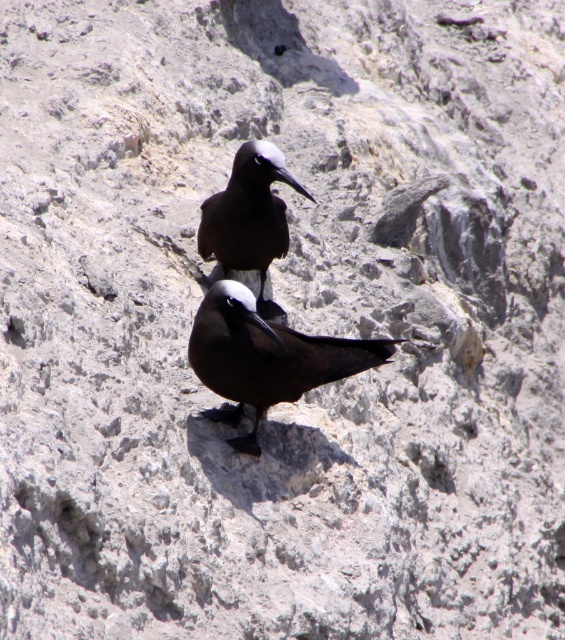
You are a birdwatcher trying to identify birds in the image. There is a point marked at coordinates point (266,356). What bird is located at that point?

The point (266,356) indicates a matte black bird at center.

You are a photographer aiming to capture a clear photo of both the matte black bird at center and the brown glossy bird at center. Since you can only focus on one bird at a time, which bird should you focus on to ensure the other remains in the background?

You should focus on the matte black bird at center because it is closer to the viewer, allowing the brown glossy bird at center to naturally fall into the background.

You are a birdwatcher observing two birds on a rocky surface. You notice a matte black bird at center and a brown glossy bird at center. Which bird has a larger size?

The brown glossy bird at center is larger than the matte black bird at center.